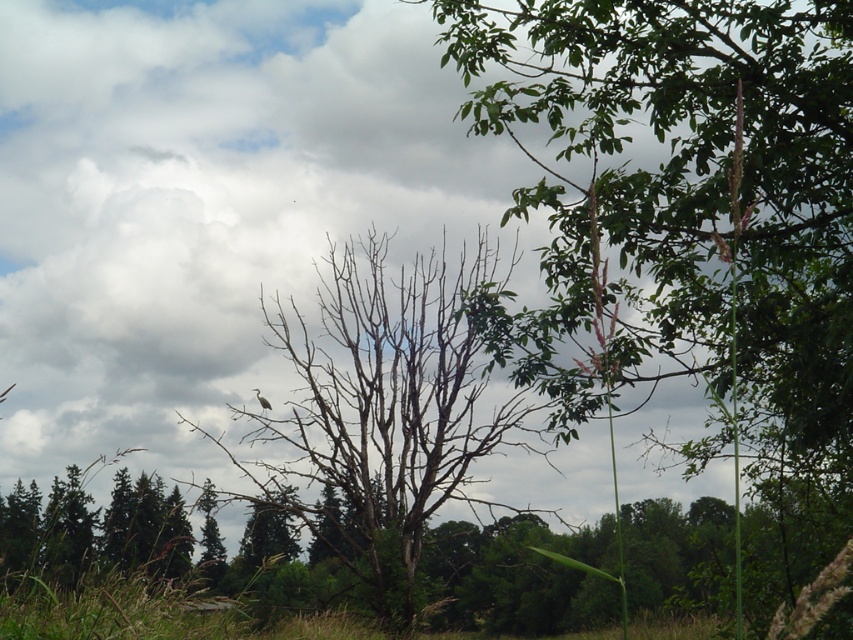
You are a birdwatcher observing the scene. You see the green leafy tree at upper right and the bare branches at center. Which tree has its branches located to the right of the other?

The green leafy tree at upper right is positioned on the right side of the bare branches at center, so the green leafy tree at upper right has its branches to the right of the bare branches at center.

You are planning to hang a bird feeder in the tree with the most space. Which tree should you choose between the green leafy tree at upper right and the bare branches at center?

The green leafy tree at upper right is larger in size than the bare branches at center, so you should choose the green leafy tree at upper right as it has more space for the bird feeder.

You are planning to hang a bird feeder between the green leafy tree at upper right and the bare branches at center. Which tree has a narrower width to consider for placement?

The green leafy tree at upper right has a narrower width than the bare branches at center, so it is the narrower one for placement.